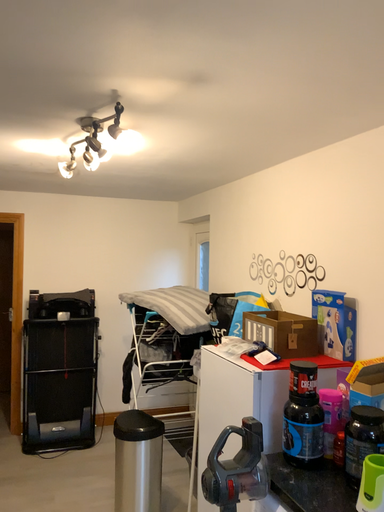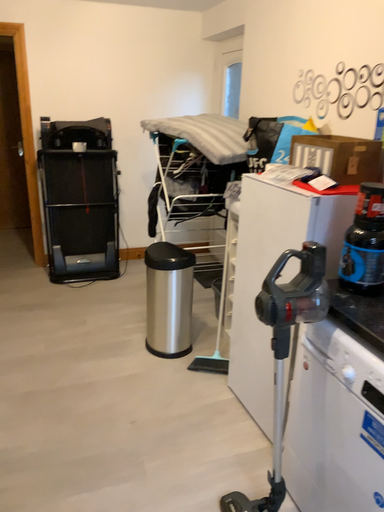
Question: Which way did the camera rotate in the video?

Choices:
 (A) rotated downward
 (B) rotated upward

Answer: (A)